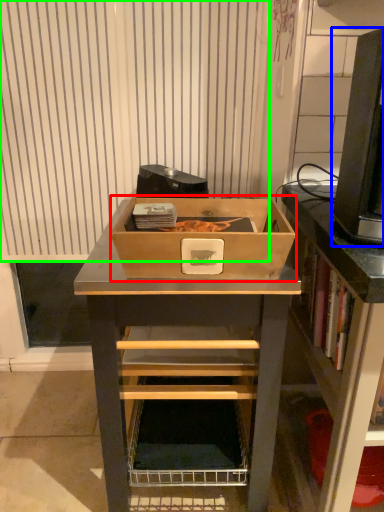
Question: Which object is the farthest from box (highlighted by a red box)? Choose among these: desktop computer (highlighted by a blue box) or curtain (highlighted by a green box).

Choices:
 (A) desktop computer
 (B) curtain

Answer: (B)